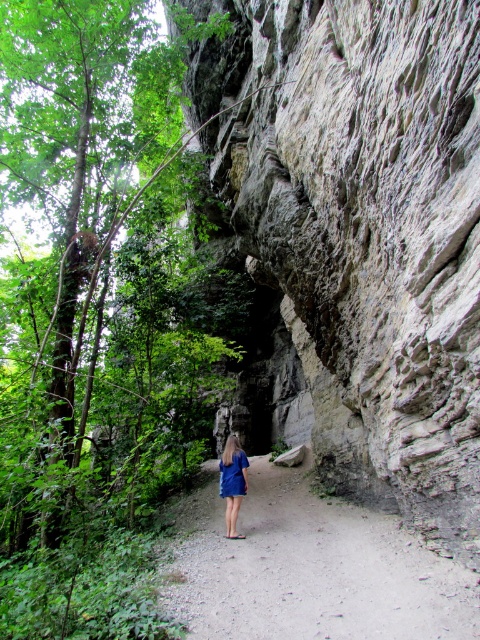
You are a hiker standing at the start of the narrow dirt path through the forest. You want to take a photo of the gray rough rock face at center from a distance of exactly 4 meters. Can you step back to achieve this without leaving the path?

The gray rough rock face at center is currently 3.81 meters away from the camera. To reach exactly 4 meters, you need to step back approximately 0.19 meters. Since the path is narrow, ensure there is enough space behind you to move back slightly without leaving the path.

You are a photographer planning to take a photo of the gray rough rock face at center and the blue satin dress at center. Since you want both subjects to be equally prominent in the image, which object should you move closer to, and why?

You should move closer to the blue satin dress at center because the gray rough rock face at center is wider than the blue satin dress at center. By moving closer to the narrower blue satin dress at center, you can balance their prominence in the photo.

You are standing at the start of the dirt path at center in a forest. You want to reach a cabin located 20 feet ahead on the path. Can you walk straight ahead without needing to turn?

The dirt path at center is 11.54 feet away from viewer, so yes, you can walk straight ahead without needing to turn since the path is long enough to reach the cabin 20 feet ahead.